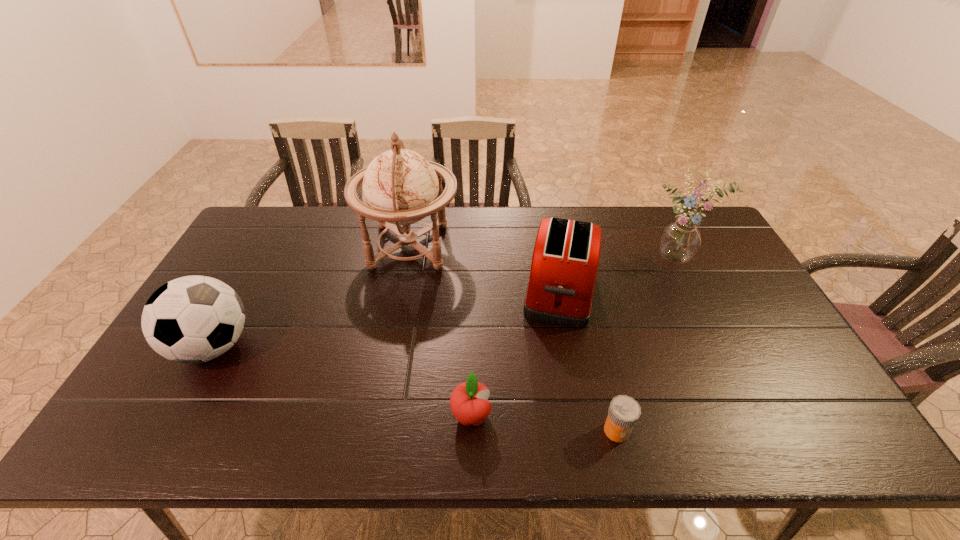
You are a GUI agent. You are given a task and a screenshot of the screen. Output one action in this format:
    pyautogui.click(x=<x>, y=<y>)
    Task: Click on the object present at the far right corner
    
    Given the screenshot: What is the action you would take?
    pyautogui.click(x=680, y=240)

At what (x,y) coordinates should I click in order to perform the action: click on free region at the far edge of the desktop. Please return your answer as a coordinate pair (x, y). The image size is (960, 540). Looking at the image, I should click on (507, 231).

Find the location of `vacant space at the near edge of the desktop`. vacant space at the near edge of the desktop is located at coordinates (396, 430).

Image resolution: width=960 pixels, height=540 pixels. I want to click on free space at the left edge of the desktop, so click(x=180, y=410).

Image resolution: width=960 pixels, height=540 pixels. In order to click on free space at the right edge of the desktop in this screenshot , I will do `click(698, 279)`.

I want to click on vacant space at the far left corner, so 274,224.

Find the location of a particular element. The image size is (960, 540). free space between the toaster and the shortest object is located at coordinates (588, 361).

Identify the location of free spot between the shortest object and the soccer ball. (415, 388).

I want to click on empty location between the second shortest object and the fifth object from right to left, so click(441, 331).

Identify the location of empty space that is in between the rightmost object and the toaster. (620, 275).